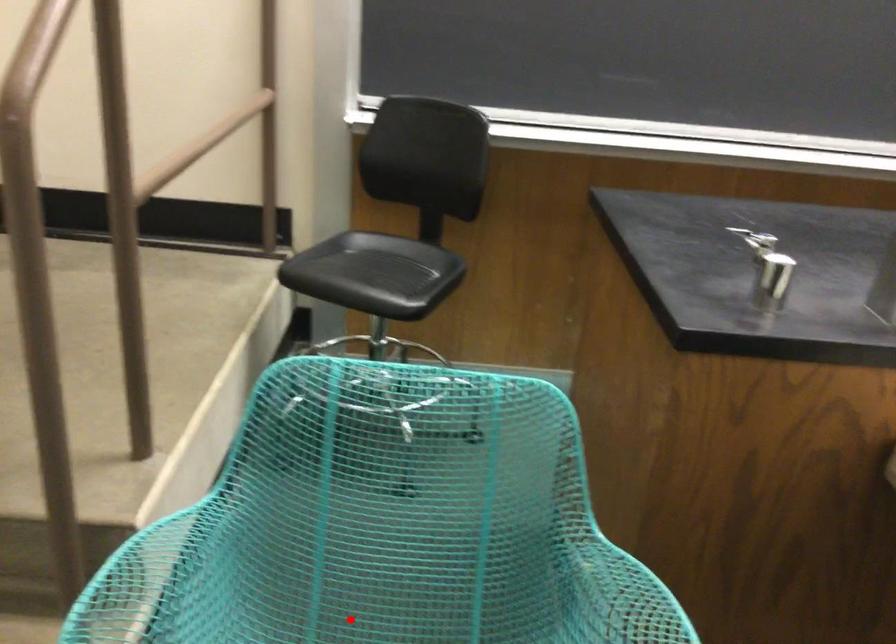
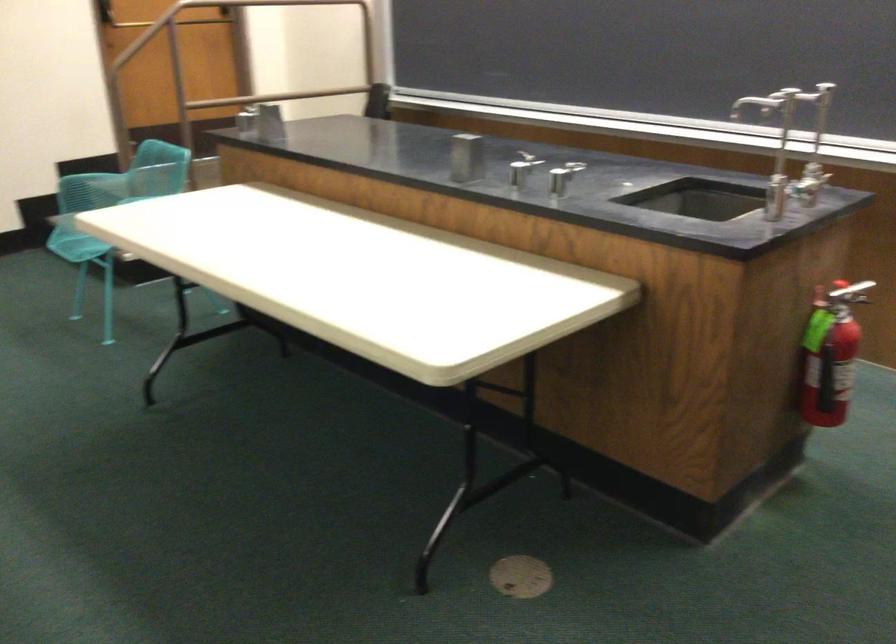
Question: I am providing you with two images of the same scene from different viewpoints. A red point is marked on the first image. Can you still see the location of the red point in image 2?

Choices:
 (A) Yes
 (B) No

Answer: (B)